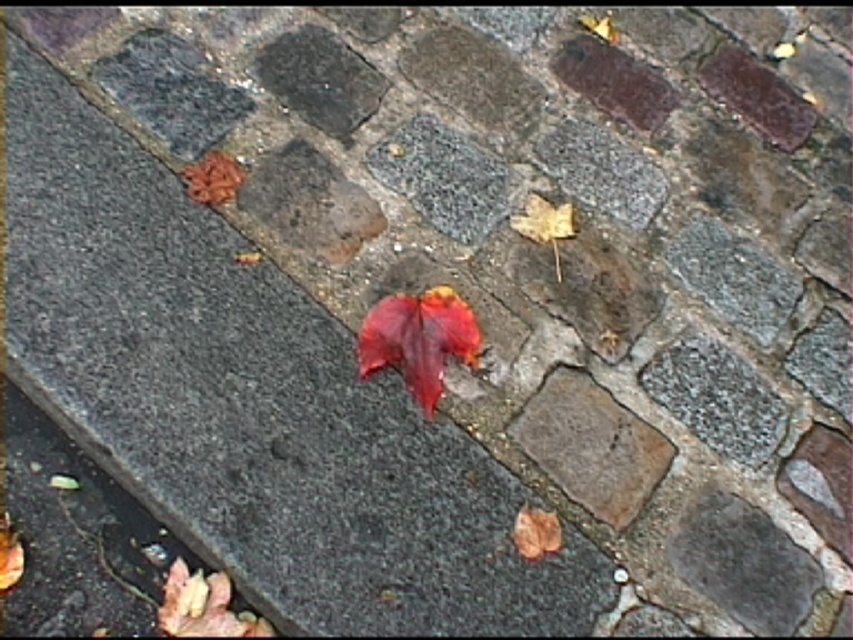
You are a gardener trying to collect leaves from the cobblestone pavement. You see a yellow matte maple leaf at upper right and a brown matte maple leaf at lower right. Which leaf is located more to the right side?

The yellow matte maple leaf at upper right is positioned more to the right side of the brown matte maple leaf at lower right.